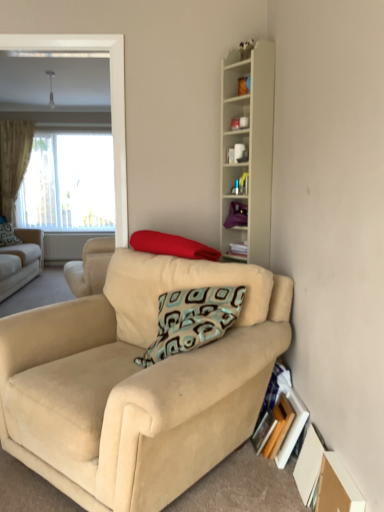
What do you see at coordinates (172, 246) in the screenshot? Image resolution: width=384 pixels, height=512 pixels. I see `red fabric pillow at center, which is the 2th pillow in top-to-bottom order` at bounding box center [172, 246].

Describe the element at coordinates (336, 487) in the screenshot. This screenshot has height=512, width=384. I see `brown cardboard box at lower right` at that location.

Where is `beige textured curtain at left`? beige textured curtain at left is located at coordinates (13, 161).

What do you see at coordinates (236, 215) in the screenshot? I see `purple fabric at upper center, the second cabinet from the top` at bounding box center [236, 215].

Where is `teal plastic cup at upper center`? teal plastic cup at upper center is located at coordinates (236, 187).

Considering the positions of objects beige suede studio couch at center, acting as the 1th studio couch starting from the front, and beige textured curtain at left in the image provided, who is more to the left, beige suede studio couch at center, acting as the 1th studio couch starting from the front, or beige textured curtain at left?

beige textured curtain at left.

Between beige suede studio couch at center, marked as the second studio couch in a left-to-right arrangement, and beige textured curtain at left, which one has smaller width?

beige textured curtain at left is thinner.

This screenshot has width=384, height=512. I want to click on curtain on the left of beige suede studio couch at center, arranged as the first studio couch when viewed from the right, so click(13, 161).

Is white matte cabinet at upper right positioned with its back to beige suede studio couch at center, arranged as the first studio couch when viewed from the right?

No.

From a real-world perspective, which object rests below the other?

beige suede studio couch at center, arranged as the first studio couch when viewed from the right, from a real-world perspective.

Can you confirm if white matte cabinet at upper right is bigger than beige suede studio couch at center, arranged as the first studio couch when viewed from the right?

Actually, white matte cabinet at upper right might be smaller than beige suede studio couch at center, arranged as the first studio couch when viewed from the right.

Is beige suede studio couch at center, marked as the second studio couch in a left-to-right arrangement, completely or partially inside white matte cabinet at upper right?

No, white matte cabinet at upper right does not contain beige suede studio couch at center, marked as the second studio couch in a left-to-right arrangement.

Is red fabric pillow at center, which is the 2th pillow in top-to-bottom order, inside purple fabric at upper center, the second cabinet from the top?

Actually, red fabric pillow at center, which is the 2th pillow in top-to-bottom order, is outside purple fabric at upper center, the second cabinet from the top.

Could you measure the distance between purple fabric at upper center, arranged as the 1th cabinet when ordered from the bottom, and red fabric pillow at center, placed as the 1th pillow when sorted from right to left?

purple fabric at upper center, arranged as the 1th cabinet when ordered from the bottom, is 18.66 inches away from red fabric pillow at center, placed as the 1th pillow when sorted from right to left.

Is the surface of purple fabric at upper center, the second cabinet from the top, in direct contact with red fabric pillow at center, which ranks as the 2th pillow in back-to-front order?

purple fabric at upper center, the second cabinet from the top, and red fabric pillow at center, which ranks as the 2th pillow in back-to-front order, are clearly separated.

From a real-world perspective, does red fabric pillow at center, the 1th pillow positioned from the front, sit lower than patterned fabric pillow at left, which is the first pillow in top-to-bottom order?

No, from a real-world perspective, red fabric pillow at center, the 1th pillow positioned from the front, is not beneath patterned fabric pillow at left, which is the first pillow in top-to-bottom order.

Which of these two, red fabric pillow at center, placed as the 1th pillow when sorted from right to left, or patterned fabric pillow at left, which is the first pillow in top-to-bottom order, is bigger?

With larger size is patterned fabric pillow at left, which is the first pillow in top-to-bottom order.

In the scene shown: Considering the relative sizes of red fabric pillow at center, which is the 2th pillow in top-to-bottom order, and patterned fabric pillow at left, which ranks as the 1th pillow in left-to-right order, in the image provided, is red fabric pillow at center, which is the 2th pillow in top-to-bottom order, wider than patterned fabric pillow at left, which ranks as the 1th pillow in left-to-right order,?

Indeed, red fabric pillow at center, which is the 2th pillow in top-to-bottom order, has a greater width compared to patterned fabric pillow at left, which ranks as the 1th pillow in left-to-right order.

Based on the photo, can you tell me how much red fabric pillow at center, which ranks as the first pillow in bottom-to-top order, and patterned fabric pillow at left, the second pillow from the right, differ in facing direction?

They differ by 86 degrees in their facing directions.

How many degrees apart are the facing directions of red fabric pillow at center, the 1th pillow positioned from the front, and beige textured curtain at left?

The angular difference between red fabric pillow at center, the 1th pillow positioned from the front, and beige textured curtain at left is 41.2 degrees.

Who is taller, red fabric pillow at center, which ranks as the 2th pillow in back-to-front order, or beige textured curtain at left?

With more height is beige textured curtain at left.

In the scene shown: Which object is thinner, red fabric pillow at center, the 2th pillow from the left, or beige textured curtain at left?

With smaller width is beige textured curtain at left.

From the picture: From the image's perspective, between beige suede studio couch at center, arranged as the first studio couch when viewed from the right, and teal plastic cup at upper center, who is located below?

From the image's view, beige suede studio couch at center, arranged as the first studio couch when viewed from the right, is below.

From a real-world perspective, is beige suede studio couch at center, which is the second studio couch in back-to-front order, located beneath teal plastic cup at upper center?

Yes, from a real-world perspective, beige suede studio couch at center, which is the second studio couch in back-to-front order, is under teal plastic cup at upper center.

From their relative heights in the image, would you say beige suede studio couch at center, which is the second studio couch in back-to-front order, is taller or shorter than teal plastic cup at upper center?

In the image, beige suede studio couch at center, which is the second studio couch in back-to-front order, appears to be taller than teal plastic cup at upper center.

Based on their sizes in the image, would you say white matte cabinet at upper right is bigger or smaller than beige textured curtain at left?

Considering their sizes, white matte cabinet at upper right takes up less space than beige textured curtain at left.

Would you say white matte cabinet at upper right is inside or outside beige textured curtain at left?

white matte cabinet at upper right is spatially situated outside beige textured curtain at left.

Which point is more distant from viewer, [260,98] or [6,198]?

The point [6,198] is farther from the camera.

From the picture: Is white matte cabinet at upper right not close to beige textured curtain at left?

That's right, there is a large distance between white matte cabinet at upper right and beige textured curtain at left.

Where is `curtain that is above the beige suede studio couch at center, which is the second studio couch in back-to-front order (from a real-world perspective)`? curtain that is above the beige suede studio couch at center, which is the second studio couch in back-to-front order (from a real-world perspective) is located at coordinates (13, 161).

Find the location of a particular element. cabinetry on the right of beige suede studio couch at center, which is the second studio couch in back-to-front order is located at coordinates (248, 148).

Considering their positions, is teal plastic cup at upper center positioned further to beige textured curtain at left than white matte cabinet at upper right?

Based on the image, teal plastic cup at upper center appears to be further to beige textured curtain at left.

From the image, which object appears to be nearer to teal plastic cup at upper center, beige textured curtain at left or beige fabric couch at left, marked as the 2th studio couch in a right-to-left arrangement?

beige fabric couch at left, marked as the 2th studio couch in a right-to-left arrangement, is closer to teal plastic cup at upper center.

Which object lies nearer to the anchor point beige suede studio couch at center, marked as the second studio couch in a left-to-right arrangement, white matte mug at upper center, which ranks as the 2th cabinet in bottom-to-top order, or beige fabric couch at left, which ranks as the first studio couch in back-to-front order?

The object closer to beige suede studio couch at center, marked as the second studio couch in a left-to-right arrangement, is white matte mug at upper center, which ranks as the 2th cabinet in bottom-to-top order.

Based on their spatial positions, is white matte cabinet at upper right or beige fabric couch at left, marked as the 2th studio couch in a right-to-left arrangement, further from brown cardboard box at lower right?

beige fabric couch at left, marked as the 2th studio couch in a right-to-left arrangement.

Considering their positions, is teal plastic cup at upper center positioned further to red fabric pillow at center, the 1th pillow positioned from the front, than white matte mug at upper center, which ranks as the 2th cabinet in bottom-to-top order?

white matte mug at upper center, which ranks as the 2th cabinet in bottom-to-top order.

Considering their positions, is beige fabric couch at left, marked as the 2th studio couch in a right-to-left arrangement, positioned closer to white matte mug at upper center, the first cabinet from the top, than red fabric pillow at center, which is the 2th pillow in top-to-bottom order?

Among the two, red fabric pillow at center, which is the 2th pillow in top-to-bottom order, is located nearer to white matte mug at upper center, the first cabinet from the top.

Looking at the image, which one is located closer to white matte cabinet at upper right, beige suede studio couch at center, acting as the 1th studio couch starting from the front, or patterned fabric pillow at left, which ranks as the 1th pillow in left-to-right order?

beige suede studio couch at center, acting as the 1th studio couch starting from the front, is positioned closer to the anchor white matte cabinet at upper right.

Based on their spatial positions, is beige textured curtain at left or red fabric pillow at center, the 1th pillow positioned from the front, closer to patterned fabric pillow at left, the second pillow from the right?

beige textured curtain at left lies closer to patterned fabric pillow at left, the second pillow from the right, than the other object.

Locate an element on the screen. cabinetry positioned between brown cardboard box at lower right and patterned fabric pillow at left, which is the 2th pillow from bottom to top, from near to far is located at coordinates (248, 148).

Locate an element on the screen. The image size is (384, 512). teal between beige fabric couch at left, marked as the 2th studio couch in a right-to-left arrangement, and brown cardboard box at lower right is located at coordinates (236, 187).

The width and height of the screenshot is (384, 512). I want to click on teal located between beige fabric couch at left, which is counted as the 2th studio couch, starting from the front, and white matte cabinet at upper right in the left-right direction, so click(x=236, y=187).

What are the coordinates of `cardboard box between beige suede studio couch at center, marked as the second studio couch in a left-to-right arrangement, and beige textured curtain at left in the front-back direction` in the screenshot? It's located at 336,487.